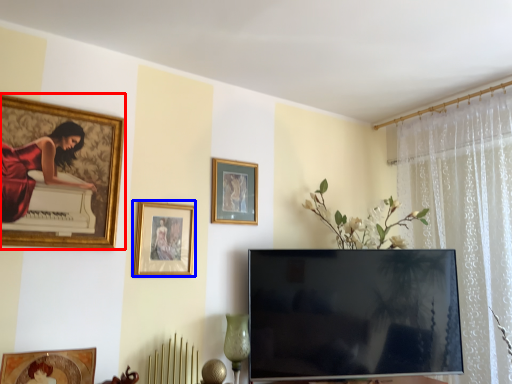
Question: Among these objects, which one is farthest to the camera, picture frame (highlighted by a red box) or picture frame (highlighted by a blue box)?

Choices:
 (A) picture frame
 (B) picture frame

Answer: (B)